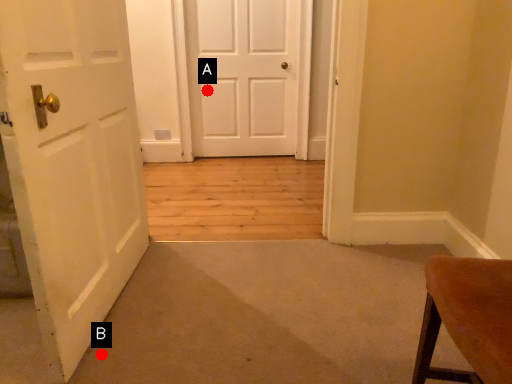
Question: Two points are circled on the image, labeled by A and B beside each circle. Which point is closer to the camera?

Choices:
 (A) A is closer
 (B) B is closer

Answer: (B)